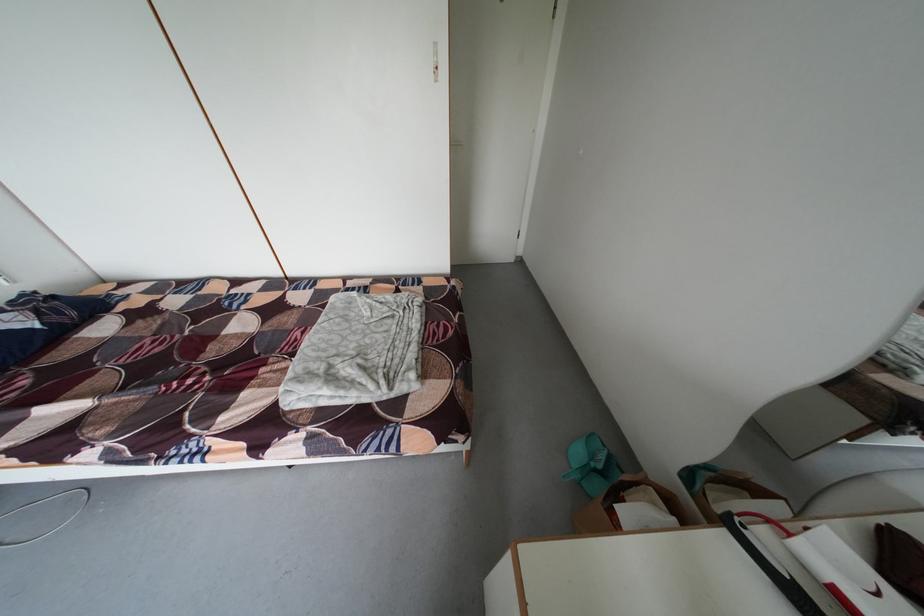
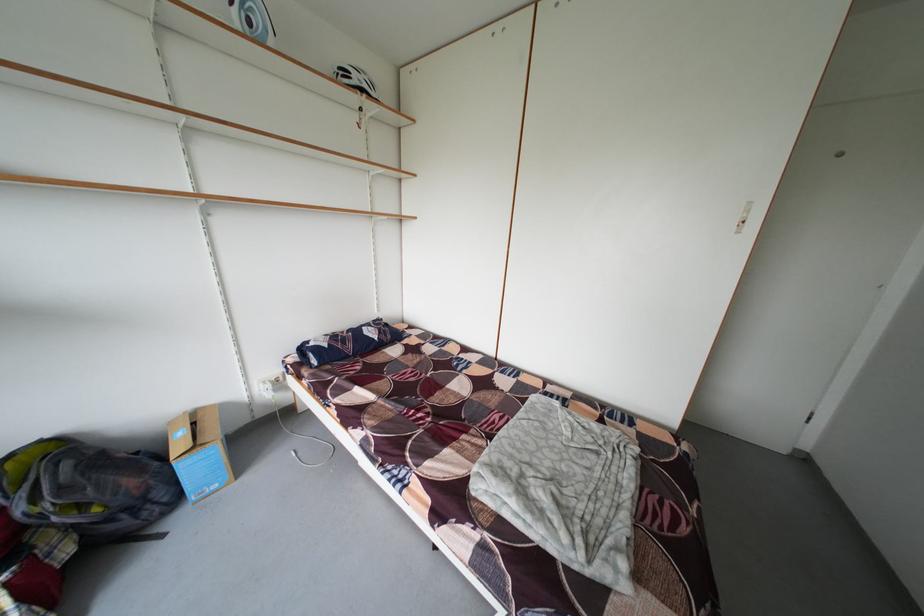
Find the pixel in the second image that matches [309,339] in the first image.

(506, 422)